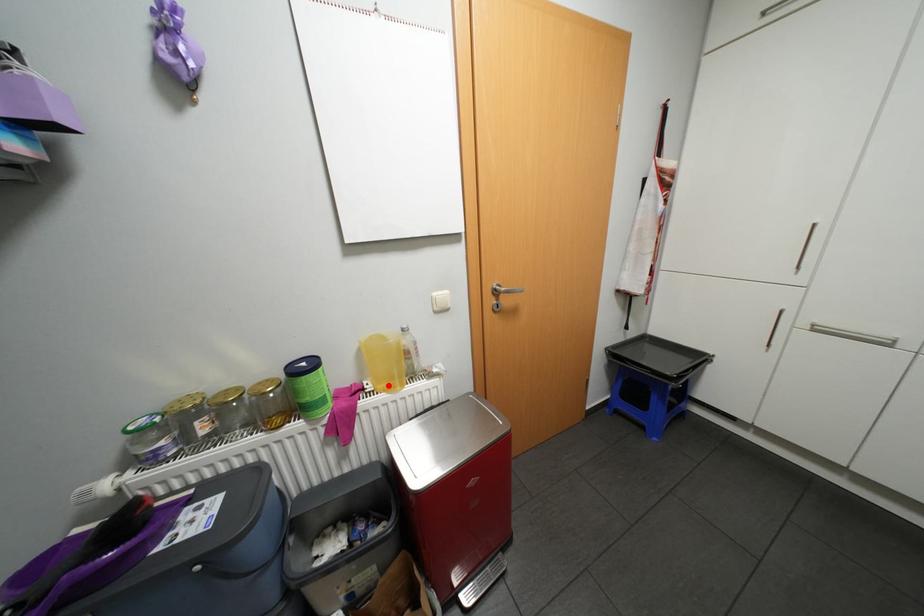
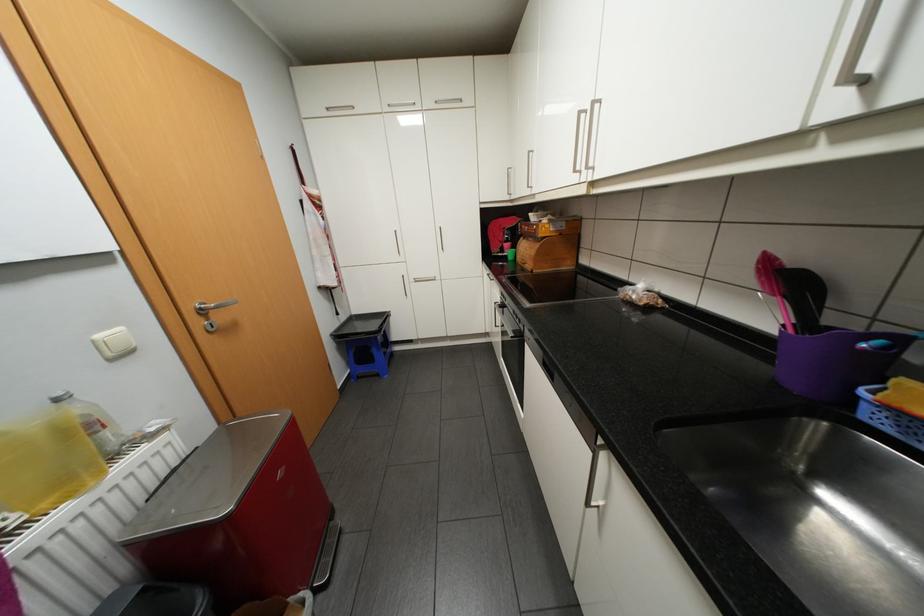
Find the pixel in the second image that matches the highlighted location in the first image.

(53, 504)